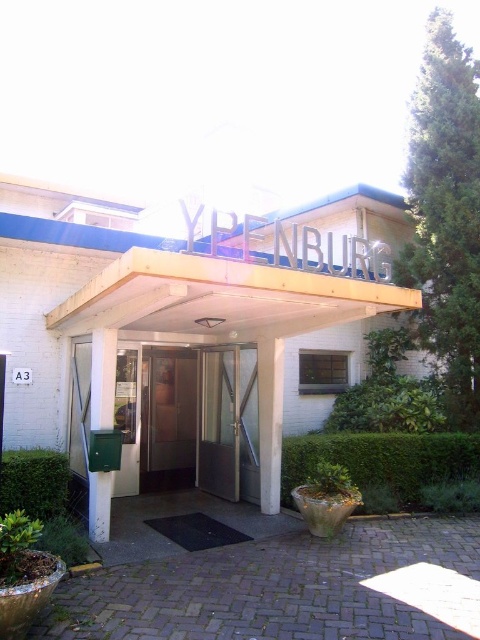
You are standing at the entrance of the YPENBURG building and need to place a small potted plant between the two points labeled as point (x=2, y=230) and point (x=164, y=424). According to the image, which point should the plant be closer to in order to be positioned in front of the other point?

The plant should be closer to point (x=2, y=230) because it is in front of point (x=164, y=424).

You are a delivery person trying to reach the entrance of the building. You see the white wooden entrance at center and the metallic glass door at center. Which one is shorter in height?

The white wooden entrance at center has a lesser height compared to the metallic glass door at center, so the white wooden entrance at center is shorter.